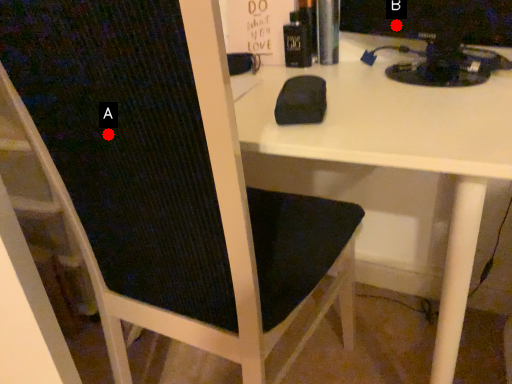
Question: Two points are circled on the image, labeled by A and B beside each circle. Which point is closer to the camera?

Choices:
 (A) A is closer
 (B) B is closer

Answer: (A)